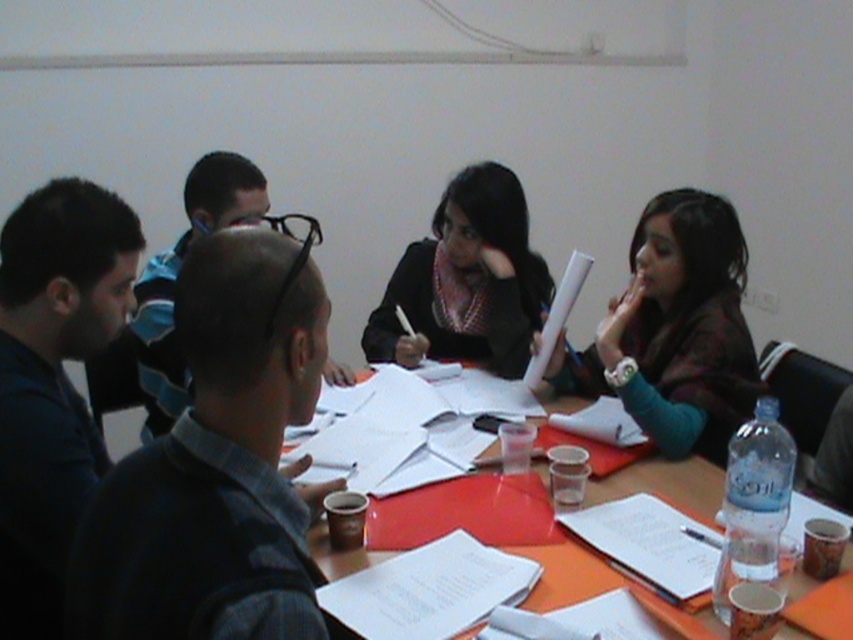
Question: Which object is the farthest from the wooden table at center?

Choices:
 (A) matte brown jacket at upper right
 (B) matte black jacket at center

Answer: (B)

Question: Does matte brown jacket at upper right lie in front of wooden table at center?

Choices:
 (A) no
 (B) yes

Answer: (A)

Question: Which point is farther to the camera?

Choices:
 (A) matte black jacket at center
 (B) wooden table at center

Answer: (A)

Question: In this image, where is matte brown jacket at upper right located relative to wooden table at center?

Choices:
 (A) left
 (B) right

Answer: (B)

Question: Among these objects, which one is nearest to the camera?

Choices:
 (A) matte brown jacket at upper right
 (B) wooden table at center
 (C) matte black jacket at center

Answer: (B)

Question: Does matte brown jacket at upper right come behind matte black jacket at center?

Choices:
 (A) no
 (B) yes

Answer: (A)